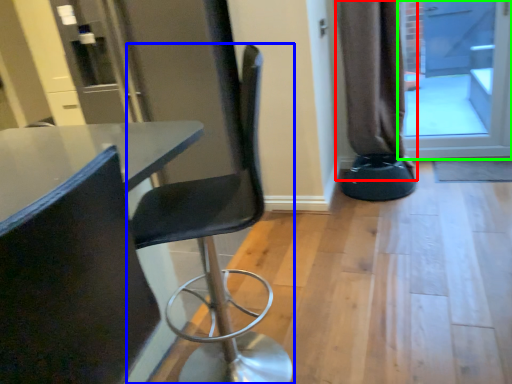
Question: Based on their relative distances, which object is nearer to curtain (highlighted by a red box)? Choose from chair (highlighted by a blue box) and screen door (highlighted by a green box).

Choices:
 (A) chair
 (B) screen door

Answer: (B)